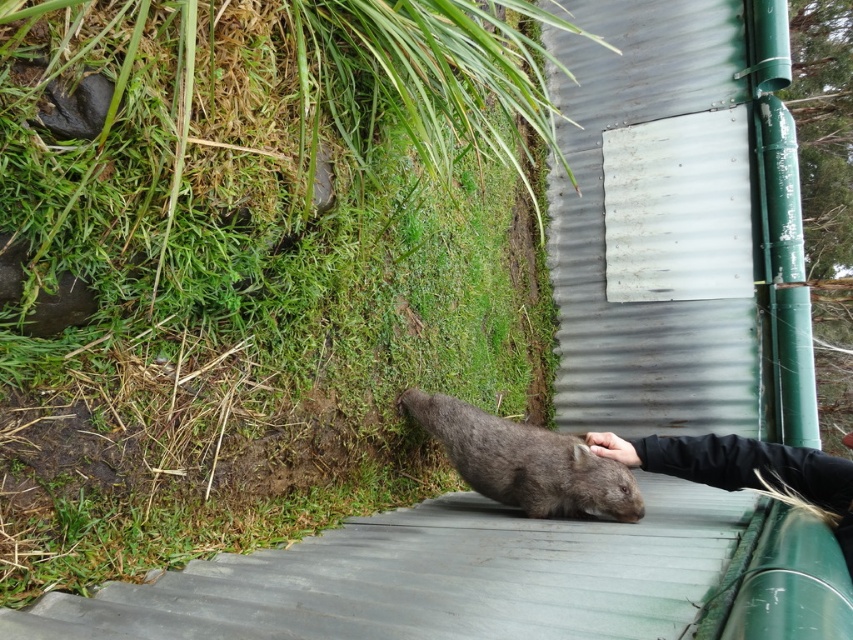
Question: Which point appears farthest from the camera in this image?

Choices:
 (A) (442, 403)
 (B) (851, 570)
 (C) (386, 298)
 (D) (637, 458)

Answer: (A)

Question: Can you confirm if green grass at lower left is smaller than black fabric hand at lower center?

Choices:
 (A) yes
 (B) no

Answer: (B)

Question: Can you confirm if green grass at lower left is wider than black fabric hand at lower center?

Choices:
 (A) yes
 (B) no

Answer: (A)

Question: Estimate the real-world distances between objects in this image. Which object is farther from the black fabric hand at lower center?

Choices:
 (A) fuzzy gray wombat at lower center
 (B) green grass at lower left
 (C) black leather hand at lower center

Answer: (B)

Question: Based on their relative distances, which object is farther from the green grass at lower left?

Choices:
 (A) fuzzy gray wombat at lower center
 (B) black fabric hand at lower center

Answer: (B)

Question: Is green grass at lower left bigger than black leather hand at lower center?

Choices:
 (A) no
 (B) yes

Answer: (B)